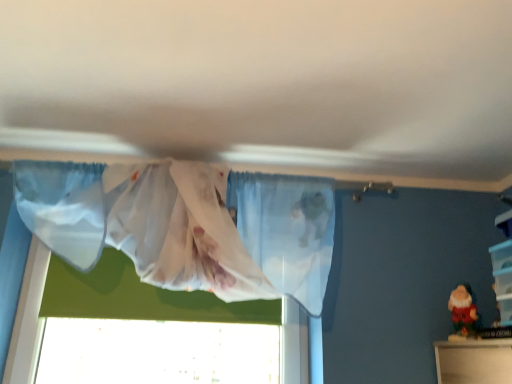
Question: Can you confirm if matte plastic santa at lower right is positioned to the right of clear plastic storage at right?

Choices:
 (A) yes
 (B) no

Answer: (B)

Question: Does matte plastic santa at lower right have a smaller size compared to clear plastic storage at right?

Choices:
 (A) no
 (B) yes

Answer: (B)

Question: From the image's perspective, does matte plastic santa at lower right appear lower than clear plastic storage at right?

Choices:
 (A) no
 (B) yes

Answer: (B)

Question: Is matte plastic santa at lower right next to clear plastic storage at right?

Choices:
 (A) no
 (B) yes

Answer: (A)

Question: Is matte plastic santa at lower right positioned beyond the bounds of clear plastic storage at right?

Choices:
 (A) no
 (B) yes

Answer: (B)

Question: Is translucent fabric curtain at upper center wider or thinner than matte plastic santa at lower right?

Choices:
 (A) thin
 (B) wide

Answer: (B)

Question: Based on their positions, is translucent fabric curtain at upper center located to the left or right of matte plastic santa at lower right?

Choices:
 (A) left
 (B) right

Answer: (A)

Question: From the image's perspective, is translucent fabric curtain at upper center located above or below matte plastic santa at lower right?

Choices:
 (A) below
 (B) above

Answer: (B)

Question: Considering the positions of translucent fabric curtain at upper center and matte plastic santa at lower right in the image, is translucent fabric curtain at upper center taller or shorter than matte plastic santa at lower right?

Choices:
 (A) short
 (B) tall

Answer: (B)

Question: In the image, is translucent fabric curtain at upper center positioned in front of or behind clear plastic storage at right?

Choices:
 (A) behind
 (B) front

Answer: (B)

Question: From their relative heights in the image, would you say translucent fabric curtain at upper center is taller or shorter than clear plastic storage at right?

Choices:
 (A) tall
 (B) short

Answer: (A)

Question: Which is correct: translucent fabric curtain at upper center is inside clear plastic storage at right, or outside of it?

Choices:
 (A) inside
 (B) outside

Answer: (B)

Question: Is point (247, 283) positioned closer to the camera than point (505, 221)?

Choices:
 (A) closer
 (B) farther

Answer: (A)

Question: Considering the positions of point (474, 304) and point (507, 264), is point (474, 304) closer or farther from the camera than point (507, 264)?

Choices:
 (A) closer
 (B) farther

Answer: (B)

Question: Which is correct: matte plastic santa at lower right is inside clear plastic storage at right, or outside of it?

Choices:
 (A) inside
 (B) outside

Answer: (B)